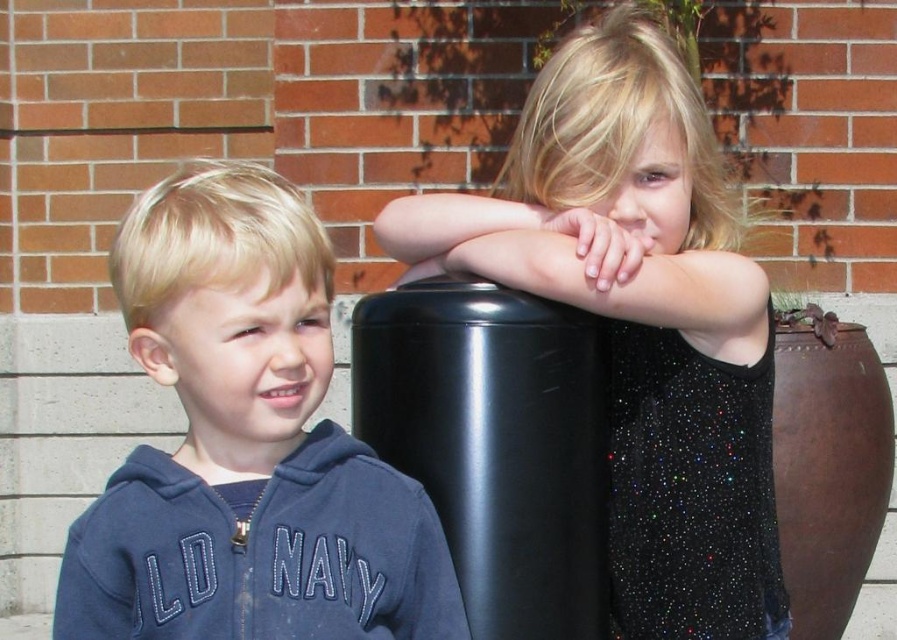
Question: Which object is the farthest from the navy fleece sweatshirt at left?

Choices:
 (A) sparkly black dress at upper right
 (B) blue fleece hoodie at left

Answer: (A)

Question: Is blue fleece hoodie at left to the right of navy fleece sweatshirt at left from the viewer's perspective?

Choices:
 (A) no
 (B) yes

Answer: (A)

Question: Estimate the real-world distances between objects in this image. Which object is farther from the blue fleece hoodie at left?

Choices:
 (A) sparkly black dress at upper right
 (B) navy fleece sweatshirt at left

Answer: (A)

Question: Considering the real-world distances, which object is farthest from the sparkly black dress at upper right?

Choices:
 (A) blue fleece hoodie at left
 (B) navy fleece sweatshirt at left

Answer: (B)

Question: Is sparkly black dress at upper right to the right of navy fleece sweatshirt at left from the viewer's perspective?

Choices:
 (A) no
 (B) yes

Answer: (B)

Question: Is blue fleece hoodie at left below navy fleece sweatshirt at left?

Choices:
 (A) no
 (B) yes

Answer: (A)